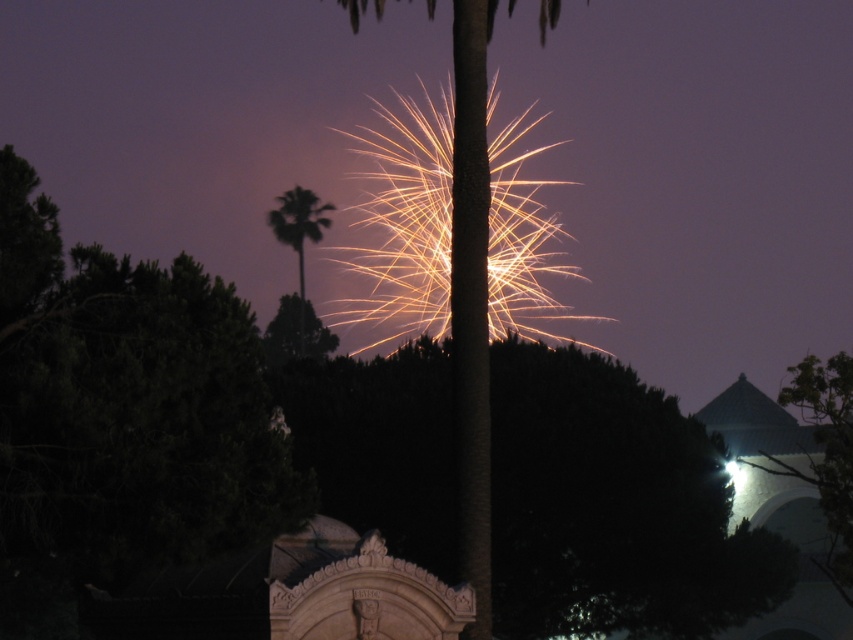
You are an artist trying to sketch this scene. You notice the brown textured palm tree at center and the green leafy palm tree at center. Which one should you draw wider to accurately represent their sizes?

The brown textured palm tree at center should be drawn wider since its width is larger than the green leafy palm tree at center.

You are an astronomer analyzing the image. You notice a point at coordinates (471, 300). What object is this point located on?

The point at coordinates (471, 300) is located on the brown textured palm tree at center.

You are a photographer trying to capture the fireworks display. You notice the brown textured palm tree at center and the green leafy palm tree at center in your shot. Which tree would block more of the fireworks if you keep the camera angle the same?

The brown textured palm tree at center has a greater height compared to the green leafy palm tree at center, so it would block more of the fireworks in the shot.